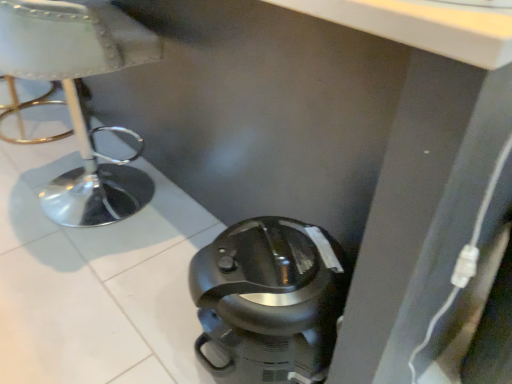
The image size is (512, 384). Describe the element at coordinates (79, 96) in the screenshot. I see `white leather stool at left` at that location.

Image resolution: width=512 pixels, height=384 pixels. Find the location of `white leather stool at left`. white leather stool at left is located at coordinates (79, 96).

This screenshot has height=384, width=512. What do you see at coordinates (269, 301) in the screenshot?
I see `black plastic coffee pot at lower center` at bounding box center [269, 301].

This screenshot has width=512, height=384. Identify the location of black plastic coffee pot at lower center. (269, 301).

Measure the distance between black plastic coffee pot at lower center and camera.

The depth of black plastic coffee pot at lower center is 29.41 inches.

This screenshot has width=512, height=384. What are the coordinates of `white leather stool at left` in the screenshot? It's located at (79, 96).

Between black plastic coffee pot at lower center and white leather stool at left, which one appears on the right side from the viewer's perspective?

From the viewer's perspective, black plastic coffee pot at lower center appears more on the right side.

Between black plastic coffee pot at lower center and white leather stool at left, which one is positioned behind?

white leather stool at left is further from the camera.

Is point (231, 304) positioned before point (64, 34)?

Yes, it is.

From the image's perspective, who appears lower, black plastic coffee pot at lower center or white leather stool at left?

black plastic coffee pot at lower center.

From a real-world perspective, between black plastic coffee pot at lower center and white leather stool at left, who is vertically lower?

black plastic coffee pot at lower center is physically lower.

Which of these two, black plastic coffee pot at lower center or white leather stool at left, is thinner?

With smaller width is black plastic coffee pot at lower center.

Based on the photo, between black plastic coffee pot at lower center and white leather stool at left, which one has less height?

Standing shorter between the two is black plastic coffee pot at lower center.

Does black plastic coffee pot at lower center have a smaller size compared to white leather stool at left?

Yes, black plastic coffee pot at lower center is smaller than white leather stool at left.

Is white leather stool at left completely or partially inside black plastic coffee pot at lower center?

No.

Is black plastic coffee pot at lower center not near white leather stool at left?

That's not correct — black plastic coffee pot at lower center is a little close to white leather stool at left.

Could you tell me if black plastic coffee pot at lower center is turned towards white leather stool at left?

No.

I want to click on home appliance on the right of white leather stool at left, so click(269, 301).

Based on the photo, which object is positioned more to the left, white leather stool at left or black plastic coffee pot at lower center?

white leather stool at left.

Is white leather stool at left in front of black plastic coffee pot at lower center?

No, white leather stool at left is behind black plastic coffee pot at lower center.

Is point (28, 55) closer to viewer compared to point (241, 382)?

No, it is behind (241, 382).

From the image's perspective, which one is positioned higher, white leather stool at left or black plastic coffee pot at lower center?

white leather stool at left appears higher in the image.

From a real-world perspective, is white leather stool at left physically below black plastic coffee pot at lower center?

No.

Considering the sizes of objects white leather stool at left and black plastic coffee pot at lower center in the image provided, who is wider, white leather stool at left or black plastic coffee pot at lower center?

white leather stool at left.

Which of these two, white leather stool at left or black plastic coffee pot at lower center, stands taller?

With more height is white leather stool at left.

Can you confirm if white leather stool at left is bigger than black plastic coffee pot at lower center?

Yes.

Can black plastic coffee pot at lower center be found inside white leather stool at left?

Definitely not — black plastic coffee pot at lower center is not inside white leather stool at left.

Is white leather stool at left in contact with black plastic coffee pot at lower center?

white leather stool at left and black plastic coffee pot at lower center are clearly separated.

Is white leather stool at left aimed at black plastic coffee pot at lower center?

No.

Measure the distance from white leather stool at left to black plastic coffee pot at lower center.

white leather stool at left and black plastic coffee pot at lower center are 34.83 inches apart.

Identify the location of furniture on the left of the black plastic coffee pot at lower center. This screenshot has width=512, height=384. click(79, 96).

In the image, there is a white leather stool at left. Identify the location of home appliance below it (from the image's perspective). This screenshot has height=384, width=512. (269, 301).

Where is `furniture lying above the black plastic coffee pot at lower center (from the image's perspective)`? The height and width of the screenshot is (384, 512). furniture lying above the black plastic coffee pot at lower center (from the image's perspective) is located at coordinates (79, 96).